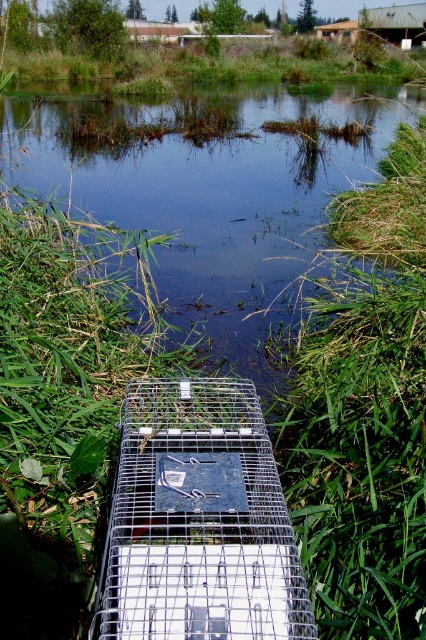
Is point (135, 397) closer to camera compared to point (132, 52)?

Yes, it is in front of point (132, 52).

Identify the location of silver metallic birdcage at center. coord(198,522).

Consider the image. Between green grassy pond at center and silver metallic birdcage at center, which one appears on the right side from the viewer's perspective?

silver metallic birdcage at center

The image size is (426, 640). What do you see at coordinates (212, 196) in the screenshot?
I see `green grassy pond at center` at bounding box center [212, 196].

At what (x,y) coordinates should I click in order to perform the action: click on green grassy pond at center. Please return your answer as a coordinate pair (x, y). Image resolution: width=426 pixels, height=640 pixels. Looking at the image, I should click on (212, 196).

Does green grassy pond at center have a larger size compared to green grass at upper center?

Correct, green grassy pond at center is larger in size than green grass at upper center.

Is point (28, 157) positioned behind point (265, 65)?

No, (28, 157) is closer to viewer.

This screenshot has height=640, width=426. What are the coordinates of `green grassy pond at center` in the screenshot? It's located at (212, 196).